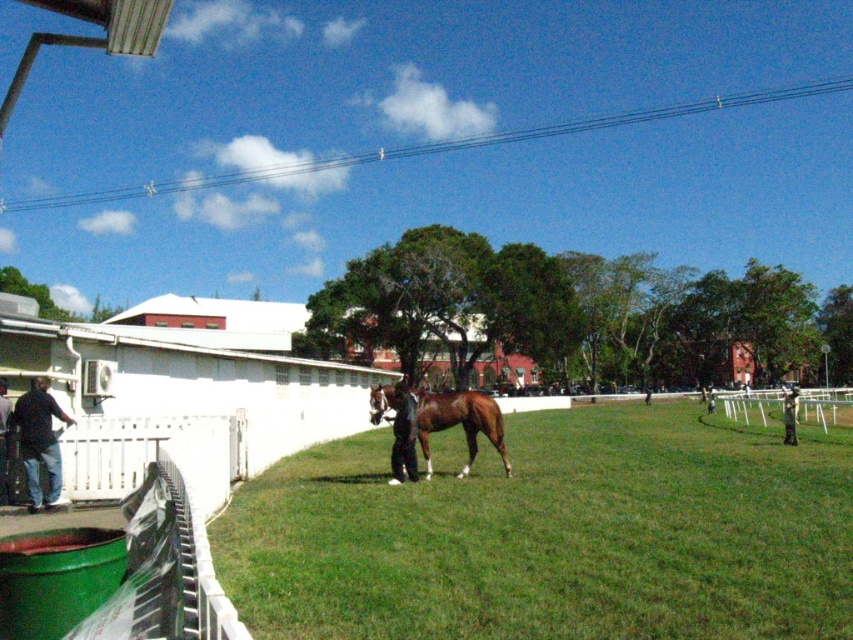
Question: Which of the following is the farthest from the observer?

Choices:
 (A) (80, 465)
 (B) (791, 388)

Answer: (B)

Question: Which is farther from the white wooden fence at lower left?

Choices:
 (A) brown glossy horse at center
 (B) jeans at left

Answer: (A)

Question: Does jeans at left have a smaller size compared to dark blue suit at center?

Choices:
 (A) no
 (B) yes

Answer: (B)

Question: Can you confirm if green grass at center is smaller than dark brown leather jacket at center?

Choices:
 (A) no
 (B) yes

Answer: (A)

Question: Can you confirm if dark brown leather jacket at center is positioned below dark blue suit at center?

Choices:
 (A) no
 (B) yes

Answer: (A)

Question: Which point is closer to the camera taking this photo?

Choices:
 (A) (817, 422)
 (B) (782, 404)
 (C) (218, 492)
 (D) (402, 460)

Answer: (C)